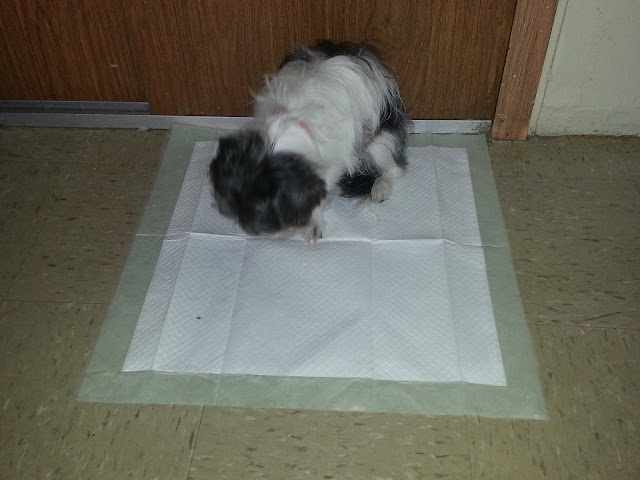
Locate an element on the screen. pee pad is located at coordinates (353, 302).